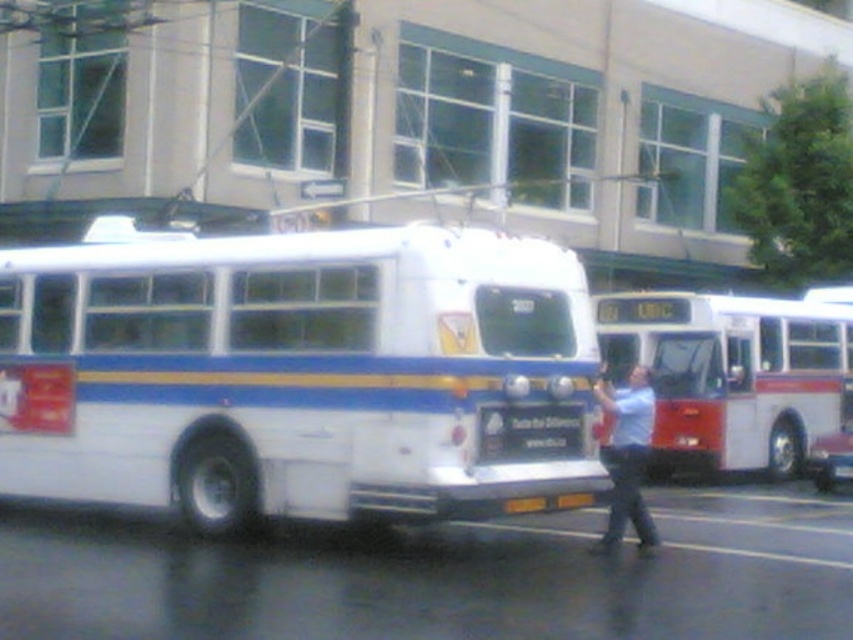
Is white matte bus at center wider than red matte bus at center?

No.

At what (x,y) coordinates should I click in order to perform the action: click on white matte bus at center. Please return your answer as a coordinate pair (x, y). The image size is (853, 640). Looking at the image, I should click on (291, 372).

Find the location of a particular element. This screenshot has height=640, width=853. white matte bus at center is located at coordinates (291, 372).

Does point (727, 448) lie behind point (577, 445)?

Yes, it is behind point (577, 445).

How far apart are red matte bus at center and black plastic sign at center?

red matte bus at center is 7.40 meters from black plastic sign at center.

Looking at this image, who is more distant from viewer, (801, 349) or (544, 410)?

Point (801, 349)

Locate an element on the screen. This screenshot has height=640, width=853. red matte bus at center is located at coordinates (730, 376).

Does white matte bus at center appear on the right side of black plastic sign at center?

No, white matte bus at center is not to the right of black plastic sign at center.

In the scene shown: Can you confirm if white matte bus at center is taller than black plastic sign at center?

Correct, white matte bus at center is much taller as black plastic sign at center.

Between point (491, 401) and point (514, 440), which one is positioned behind?

Positioned behind is point (514, 440).

Identify the location of white matte bus at center. click(291, 372).